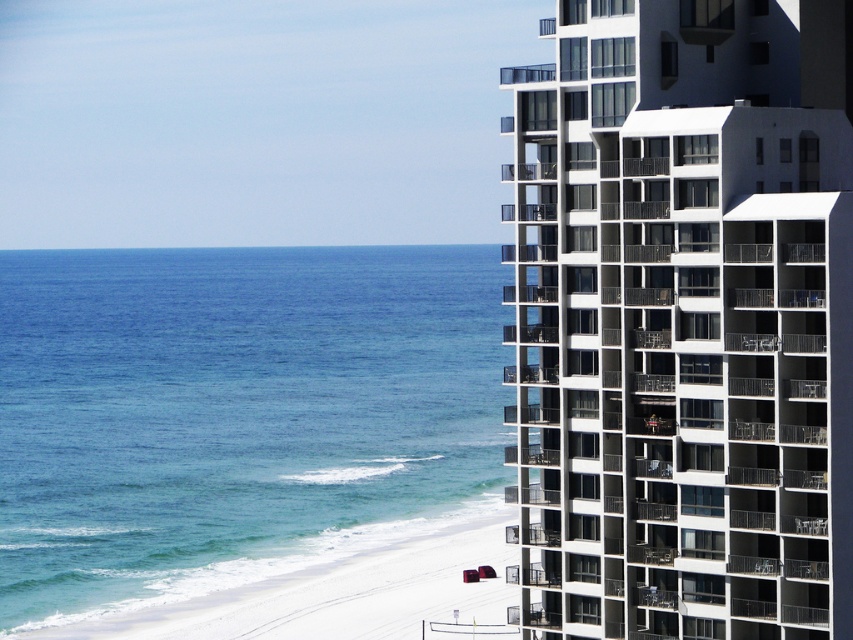
Which of these two, white glass building at right or white sand at lower left, stands taller?

white glass building at right

Is white glass building at right bigger than white sand at lower left?

Incorrect, white glass building at right is not larger than white sand at lower left.

Between point (817, 138) and point (111, 627), which one is positioned behind?

The point (111, 627) is behind.

Identify the location of white glass building at right. Image resolution: width=853 pixels, height=640 pixels. [682, 321].

Who is more distant from viewer, (764, 522) or (22, 314)?

The point (22, 314) is more distant.

Does point (706, 6) come farther from viewer compared to point (74, 577)?

That is False.

Between point (822, 173) and point (221, 497), which one is positioned behind?

Positioned behind is point (221, 497).

You are a GUI agent. You are given a task and a screenshot of the screen. Output one action in this format:
    pyautogui.click(x=<x>, y=<y>)
    Task: Click on the white glass building at right
    
    Given the screenshot: What is the action you would take?
    pyautogui.click(x=682, y=321)

Is the position of blue water at lower left less distant than that of white sand at lower left?

That is False.

Does blue water at lower left appear on the left side of white sand at lower left?

Yes, blue water at lower left is to the left of white sand at lower left.

Describe the element at coordinates (231, 412) in the screenshot. I see `blue water at lower left` at that location.

Image resolution: width=853 pixels, height=640 pixels. In order to click on blue water at lower left in this screenshot , I will do `click(231, 412)`.